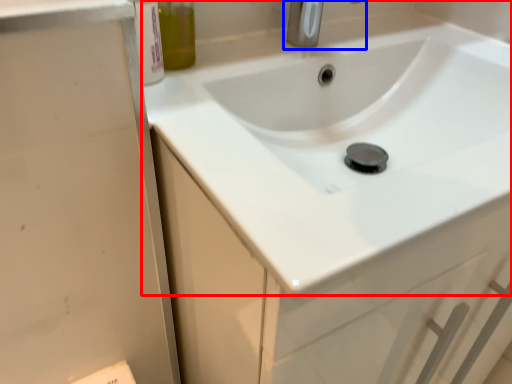
Question: Which of the following is the farthest to the observer, sink (highlighted by a red box) or tap (highlighted by a blue box)?

Choices:
 (A) sink
 (B) tap

Answer: (B)